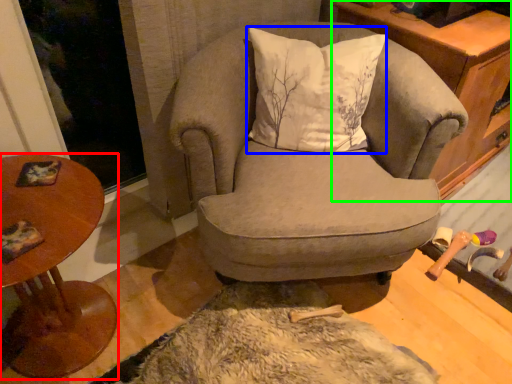
Question: Which is nearer to the table (highlighted by a red box)? pillow (highlighted by a blue box) or cabinetry (highlighted by a green box).

Choices:
 (A) pillow
 (B) cabinetry

Answer: (A)